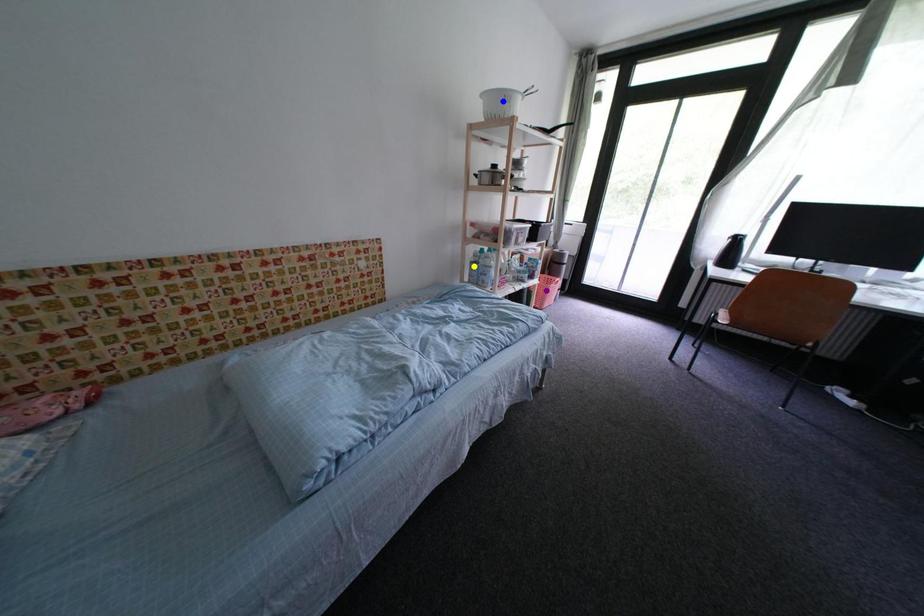
Order these from farthest to nearest:
yellow point | blue point | purple point

1. purple point
2. yellow point
3. blue point